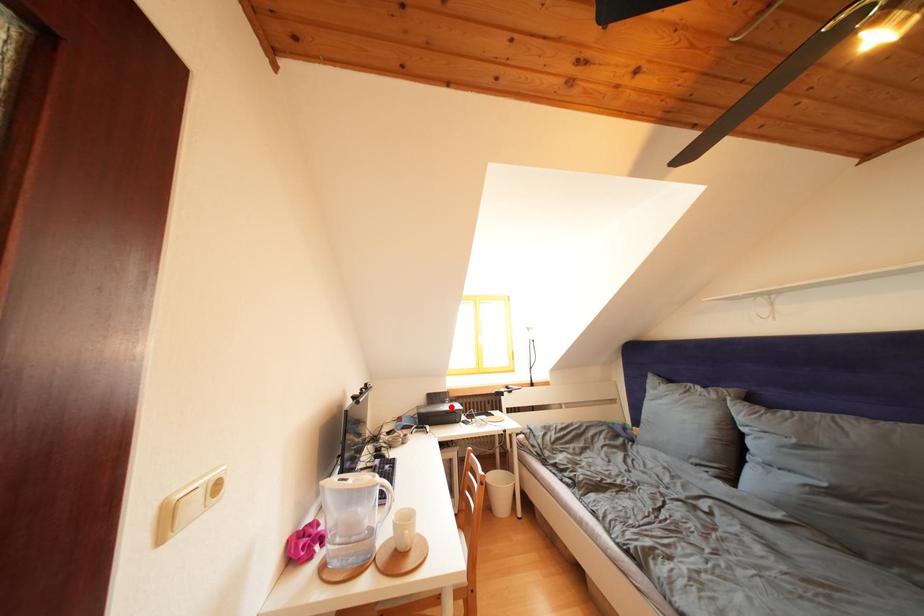
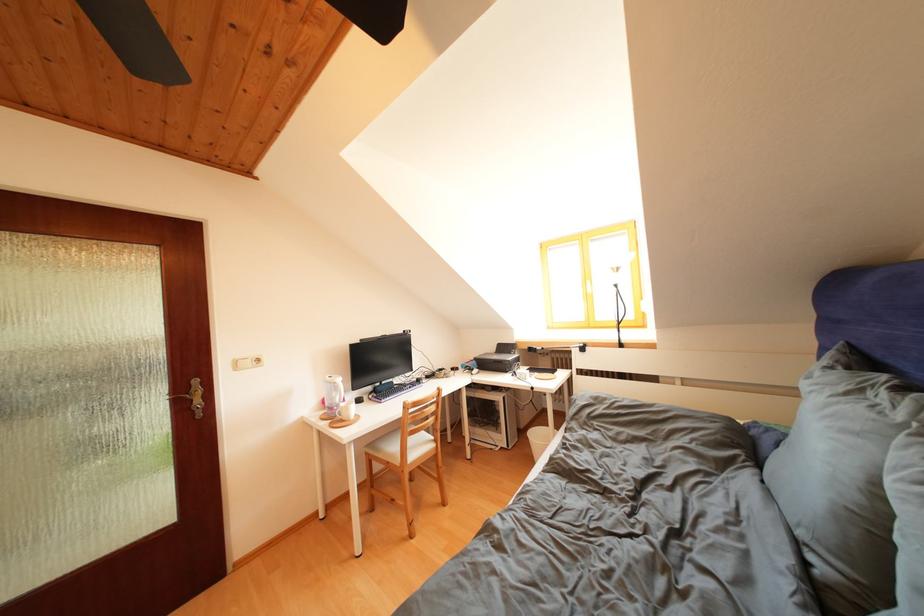
Question: A red point is marked in image1. In image2, is the corresponding 3D point closer to the camera or farther? Reply with the corresponding letter.

Choices:
 (A) The corresponding 3D point is closer.
 (B) The corresponding 3D point is farther.

Answer: (A)